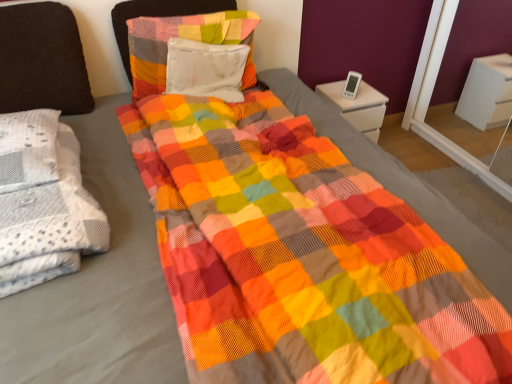
Question: Is white glossy nightstand at upper right with white textured blanket at left?

Choices:
 (A) no
 (B) yes

Answer: (A)

Question: Is white glossy nightstand at upper right smaller than white textured blanket at left?

Choices:
 (A) yes
 (B) no

Answer: (A)

Question: Considering the relative sizes of white glossy nightstand at upper right and white textured blanket at left in the image provided, is white glossy nightstand at upper right wider than white textured blanket at left?

Choices:
 (A) no
 (B) yes

Answer: (A)

Question: Is white glossy nightstand at upper right positioned far away from white textured blanket at left?

Choices:
 (A) yes
 (B) no

Answer: (A)

Question: From the image's perspective, is white glossy nightstand at upper right on top of white textured blanket at left?

Choices:
 (A) yes
 (B) no

Answer: (A)

Question: Considering the positions of white fabric pillow at center, which is the first pillow in right-to-left order, and white textured blanket at left in the image, is white fabric pillow at center, which is the first pillow in right-to-left order, taller or shorter than white textured blanket at left?

Choices:
 (A) short
 (B) tall

Answer: (B)

Question: From a real-world perspective, is white fabric pillow at center, which is the first pillow in right-to-left order, above or below white textured blanket at left?

Choices:
 (A) above
 (B) below

Answer: (A)

Question: Looking at their shapes, would you say white fabric pillow at center, which is the third pillow from left to right, is wider or thinner than white textured blanket at left?

Choices:
 (A) thin
 (B) wide

Answer: (A)

Question: Is white fabric pillow at center, which is the first pillow in right-to-left order, bigger or smaller than white textured blanket at left?

Choices:
 (A) big
 (B) small

Answer: (B)

Question: In terms of height, does white glossy nightstand at upper right look taller or shorter compared to white fabric pillow at center, which is the first pillow in right-to-left order?

Choices:
 (A) short
 (B) tall

Answer: (B)

Question: From the image's perspective, is white glossy nightstand at upper right located above or below white fabric pillow at center, which is the first pillow in right-to-left order?

Choices:
 (A) below
 (B) above

Answer: (A)

Question: Looking at their shapes, would you say white glossy nightstand at upper right is wider or thinner than white fabric pillow at center, which is the first pillow in right-to-left order?

Choices:
 (A) wide
 (B) thin

Answer: (A)

Question: Considering the relative positions of white glossy nightstand at upper right and white fabric pillow at center, which is the third pillow from left to right, in the image provided, is white glossy nightstand at upper right to the left or to the right of white fabric pillow at center, which is the third pillow from left to right,?

Choices:
 (A) left
 (B) right

Answer: (B)

Question: In terms of height, does textured cotton pillow at upper center, arranged as the second pillow when viewed from the right, look taller or shorter compared to white glossy nightstand at upper right?

Choices:
 (A) short
 (B) tall

Answer: (B)

Question: Based on their positions, is textured cotton pillow at upper center, arranged as the second pillow when viewed from the right, located to the left or right of white glossy nightstand at upper right?

Choices:
 (A) left
 (B) right

Answer: (A)